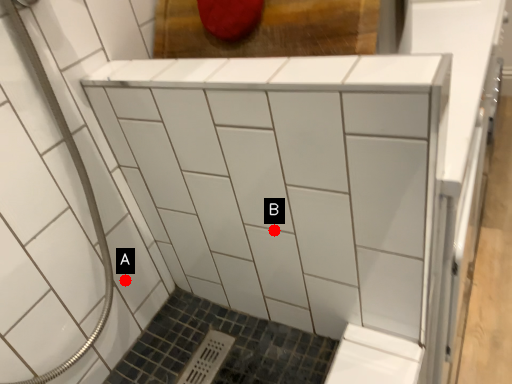
Question: Two points are circled on the image, labeled by A and B beside each circle. Which of the following is the farthest from the observer?

Choices:
 (A) A is further
 (B) B is further

Answer: (A)